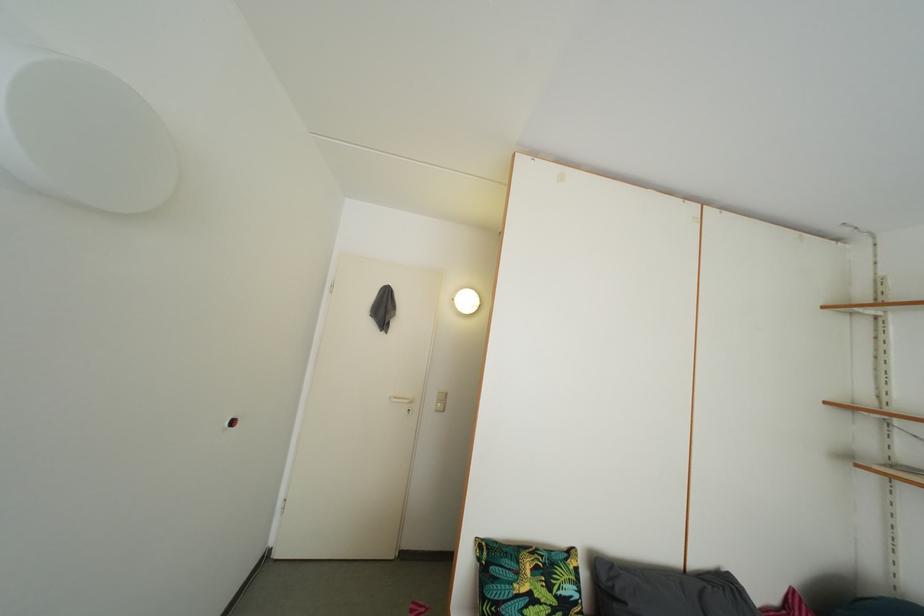
At what (x,y) coordinates should I click in order to perform the action: click on dark grey pillow. Please return your answer as a coordinate pair (x, y). Looking at the image, I should click on (665, 591).